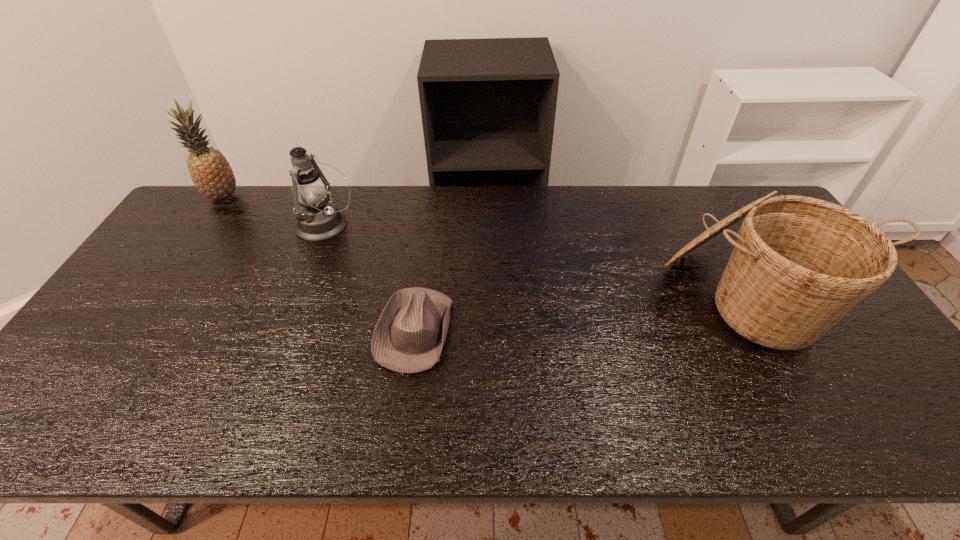
Identify the location of free point located on the left of the second object from right to left. The width and height of the screenshot is (960, 540). (327, 330).

Where is `pineapple at the far edge`? This screenshot has height=540, width=960. pineapple at the far edge is located at coordinates (212, 175).

Identify the location of oil lamp positioned at the far edge. (318, 219).

You are a GUI agent. You are given a task and a screenshot of the screen. Output one action in this format:
    pyautogui.click(x=<x>, y=<y>)
    Task: Click on the object located at the left edge
    
    Given the screenshot: What is the action you would take?
    pyautogui.click(x=212, y=175)

The image size is (960, 540). What are the coordinates of `object present at the right edge` in the screenshot? It's located at (800, 264).

Where is `object at the far left corner`? Image resolution: width=960 pixels, height=540 pixels. object at the far left corner is located at coordinates (212, 175).

At what (x,y) coordinates should I click in order to perform the action: click on free space at the far edge of the desktop. Please return your answer as a coordinate pair (x, y). Looking at the image, I should click on (576, 218).

Identify the location of free region at the near edge of the desktop. click(x=661, y=406).

Locate an element on the screen. vacant space at the left edge of the desktop is located at coordinates (99, 323).

Locate an element on the screen. This screenshot has height=540, width=960. vacant space at the far left corner of the desktop is located at coordinates (198, 214).